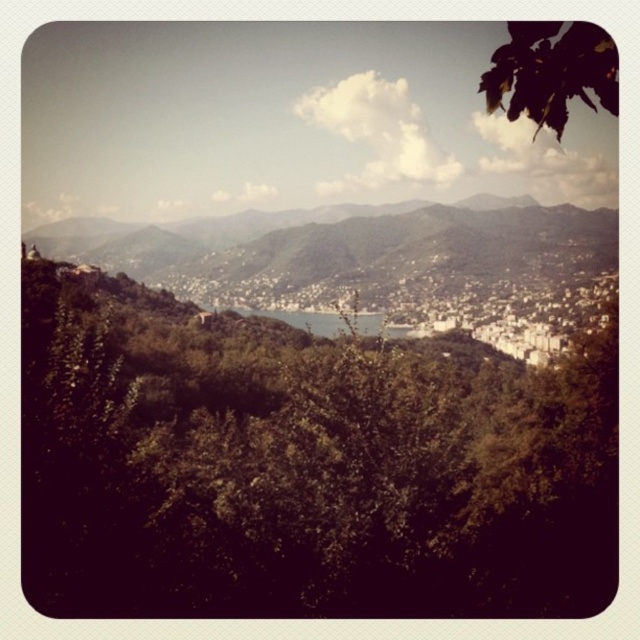
Measure the distance between point (474, 307) and camera.

The distance of point (474, 307) from camera is 2243.88 feet.

You are a GUI agent. You are given a task and a screenshot of the screen. Output one action in this format:
    pyautogui.click(x=<x>, y=<y>)
    Task: Click on the green textured mountain at center
    
    Given the screenshot: What is the action you would take?
    pyautogui.click(x=372, y=260)

This screenshot has width=640, height=640. Identify the location of green textured mountain at center. click(x=372, y=260).

Does green leafy tree at upper right come in front of blue water at center?

That is True.

Does green leafy tree at upper right have a greater height compared to blue water at center?

Correct, green leafy tree at upper right is much taller as blue water at center.

Locate an element on the screen. green leafy tree at upper right is located at coordinates (552, 72).

Based on the photo, between green leafy tree at lower left and green leafy tree at upper right, which one has less height?

green leafy tree at upper right

Between point (288, 401) and point (561, 42), which one is positioned behind?

Positioned behind is point (288, 401).

Locate an element on the screen. The width and height of the screenshot is (640, 640). green leafy tree at lower left is located at coordinates (301, 467).